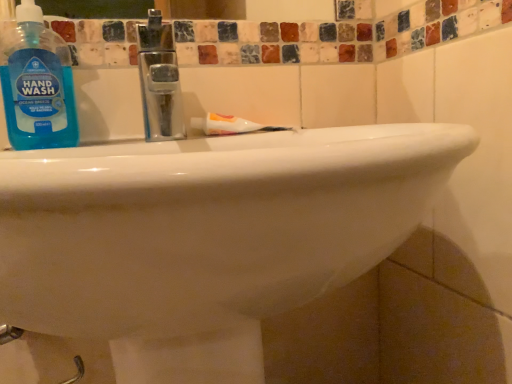
Question: Is point (231, 117) positioned closer to the camera than point (42, 89)?

Choices:
 (A) closer
 (B) farther

Answer: (B)

Question: From the image's perspective, relative to blue translucent liquid hand wash at upper left, is white glossy toothpaste at center above or below?

Choices:
 (A) above
 (B) below

Answer: (B)

Question: From their relative heights in the image, would you say white glossy toothpaste at center is taller or shorter than blue translucent liquid hand wash at upper left?

Choices:
 (A) short
 (B) tall

Answer: (A)

Question: Looking at the image, does blue translucent liquid hand wash at upper left seem bigger or smaller compared to white glossy toothpaste at center?

Choices:
 (A) small
 (B) big

Answer: (B)

Question: Does point (38, 94) appear closer or farther from the camera than point (214, 132)?

Choices:
 (A) closer
 (B) farther

Answer: (A)

Question: From a real-world perspective, is blue translucent liquid hand wash at upper left positioned above or below white glossy toothpaste at center?

Choices:
 (A) below
 (B) above

Answer: (B)

Question: Is blue translucent liquid hand wash at upper left situated inside white glossy toothpaste at center or outside?

Choices:
 (A) outside
 (B) inside

Answer: (A)